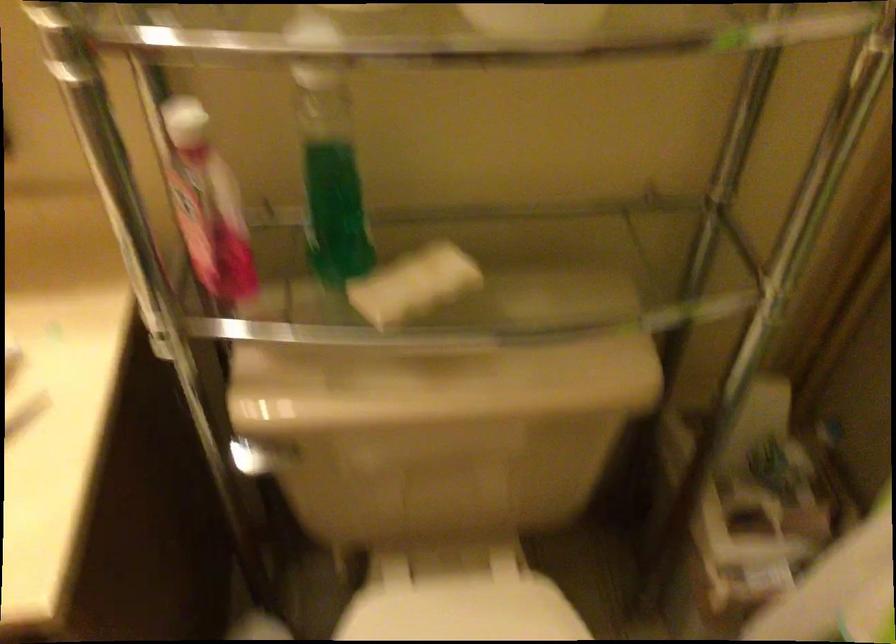
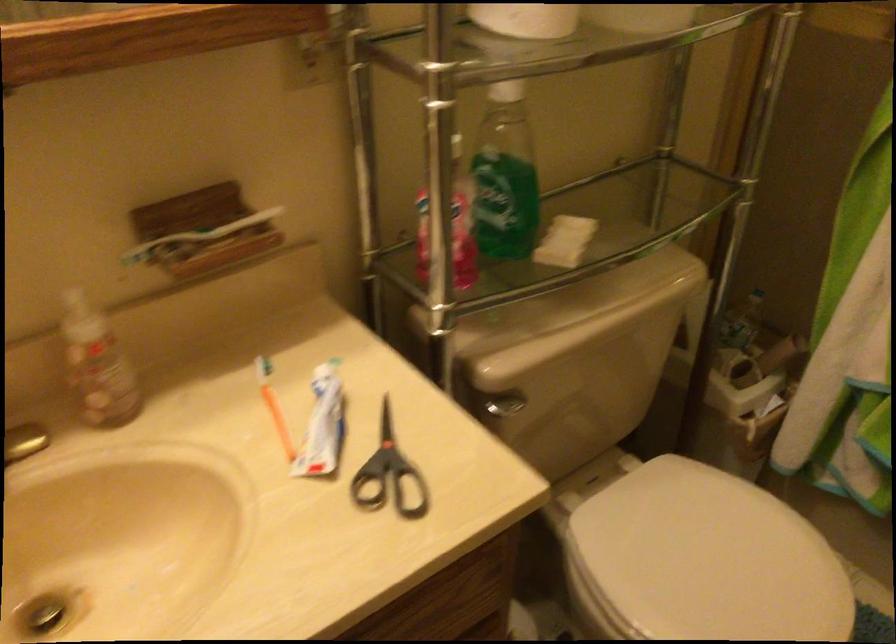
The point at (798, 524) is marked in the first image. Where is the corresponding point in the second image?

(764, 361)